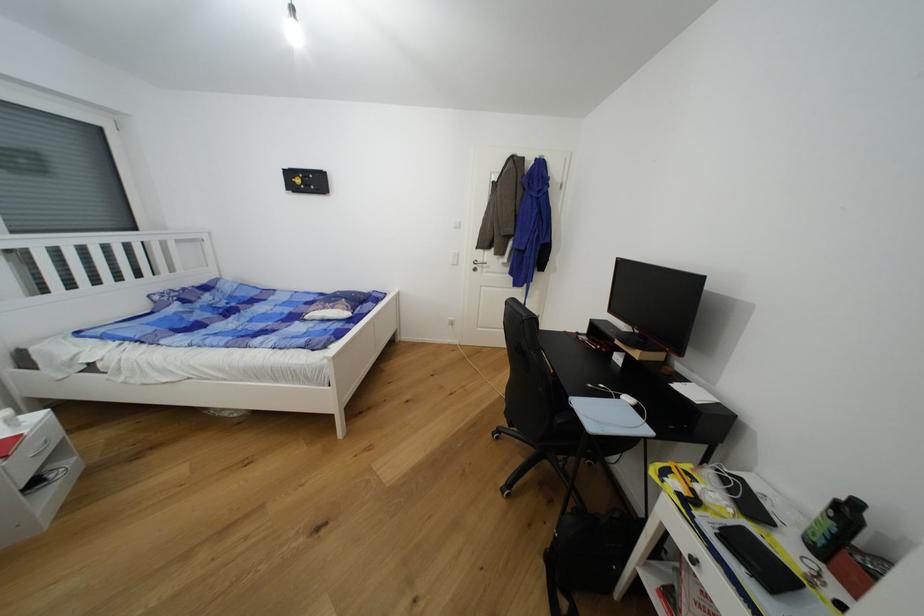
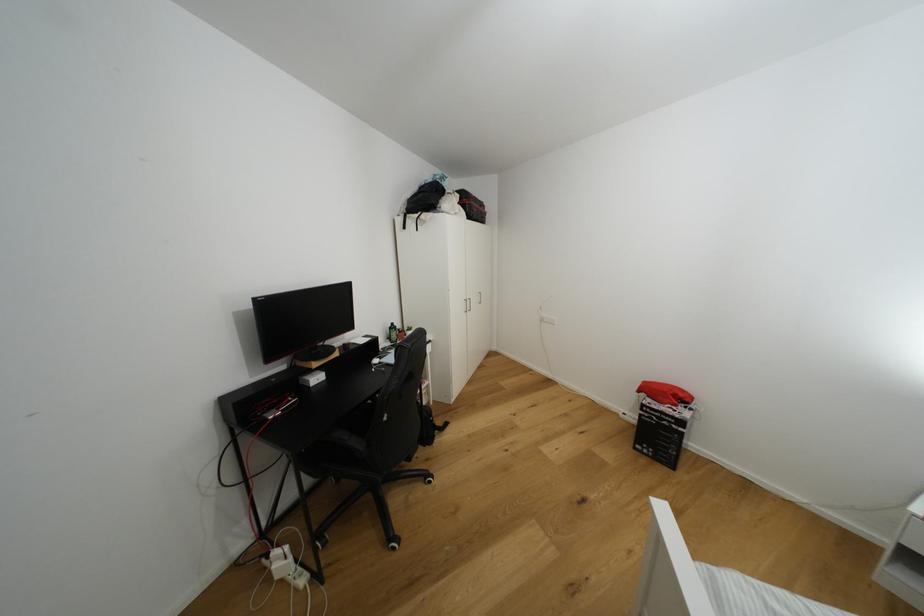
Where in the second image is the point corresponding to point 844,507 from the first image?

(395, 330)